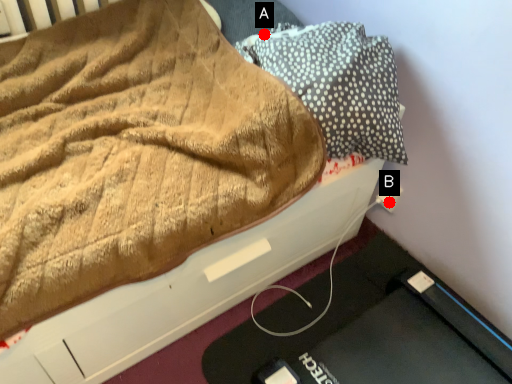
Question: Two points are circled on the image, labeled by A and B beside each circle. Among these points, which one is farthest from the camera?

Choices:
 (A) A is further
 (B) B is further

Answer: (B)